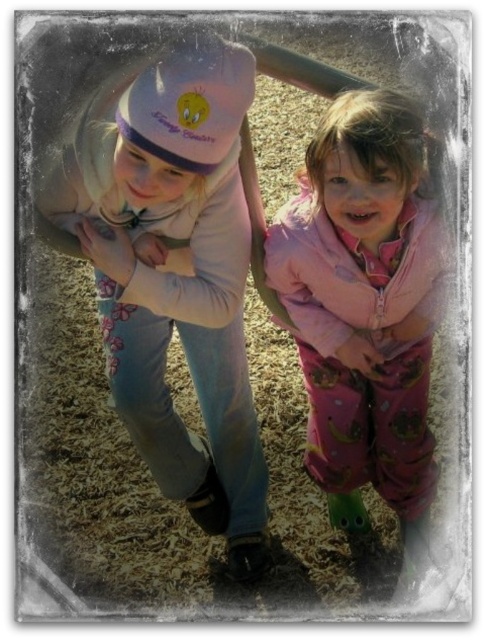
Does pink fleece sweater at upper center have a smaller size compared to pink fleece jacket at center?

Actually, pink fleece sweater at upper center might be larger than pink fleece jacket at center.

Who is shorter, pink fleece sweater at upper center or pink fleece jacket at center?

pink fleece jacket at center is shorter.

Does point (157, 380) come in front of point (341, 291)?

No, (157, 380) is behind (341, 291).

Image resolution: width=486 pixels, height=640 pixels. Identify the location of pink fleece sweater at upper center. (177, 280).